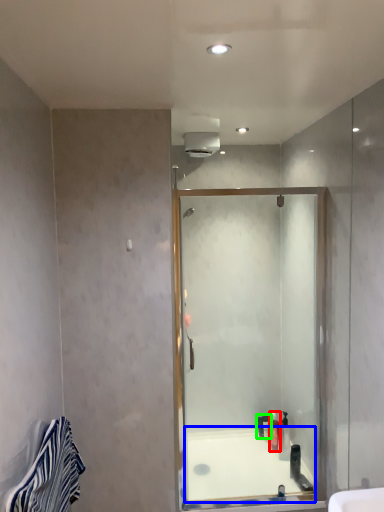
Question: Which object is positioned farthest from toiletry (highlighted by a red box)? Select from bath (highlighted by a blue box) and toiletry (highlighted by a green box).

Choices:
 (A) bath
 (B) toiletry

Answer: (A)